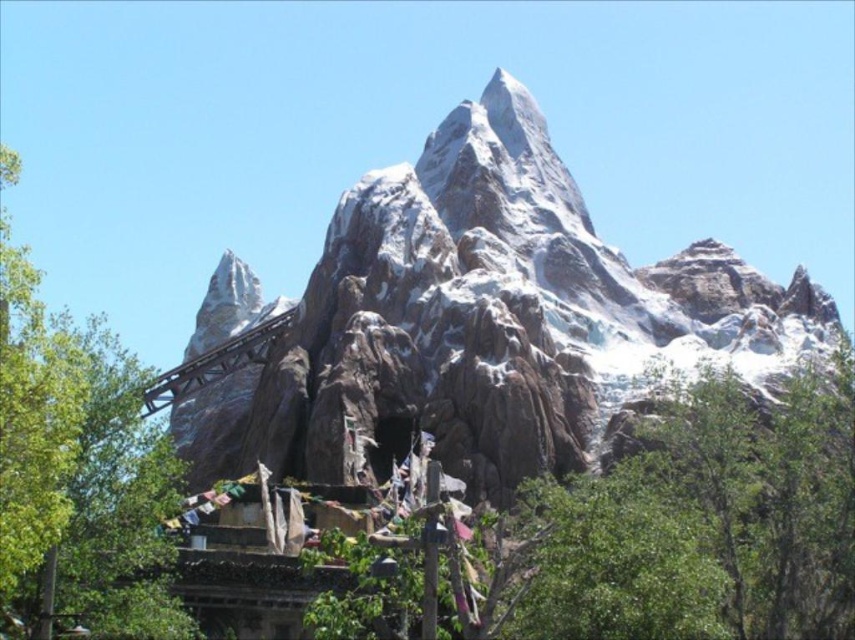
Question: Does green leafy tree at center appear on the right side of green leafy tree at left?

Choices:
 (A) yes
 (B) no

Answer: (A)

Question: Which point is farther to the camera?

Choices:
 (A) (774, 484)
 (B) (160, 573)

Answer: (A)

Question: Is green leafy tree at center to the right of green leafy tree at left from the viewer's perspective?

Choices:
 (A) yes
 (B) no

Answer: (A)

Question: Which point is closer to the camera?

Choices:
 (A) (608, 563)
 (B) (80, 506)

Answer: (A)

Question: Does green leafy tree at center have a greater width compared to green leafy tree at left?

Choices:
 (A) no
 (B) yes

Answer: (A)